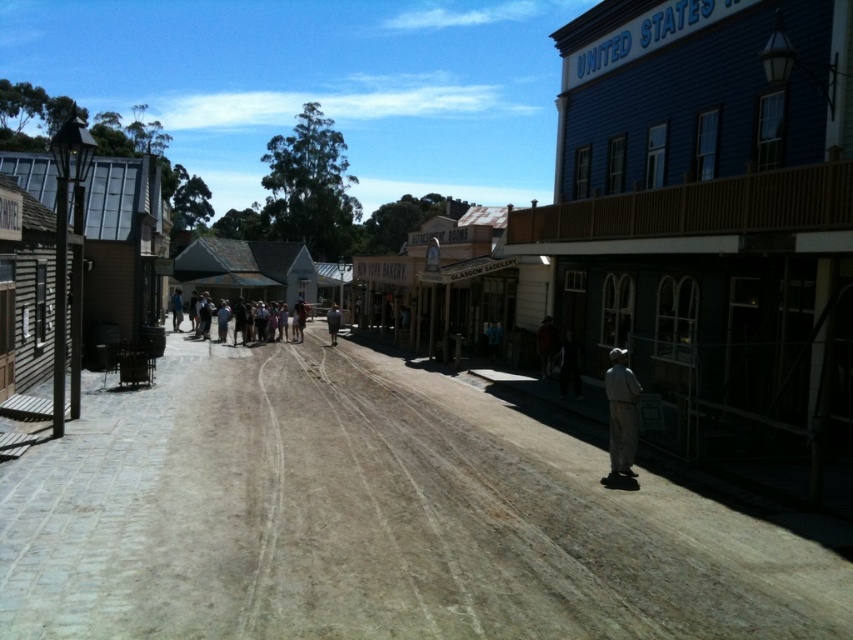
Can you confirm if brown dusty dirt track at center is shorter than brown leather jacket at center?

Yes, brown dusty dirt track at center is shorter than brown leather jacket at center.

Which is below, brown dusty dirt track at center or brown leather jacket at center?

brown dusty dirt track at center is below.

Which is behind, point (231, 499) or point (547, 346)?

Point (547, 346)

Where is `brown dusty dirt track at center`? brown dusty dirt track at center is located at coordinates (373, 518).

Is point (553, 353) in front of point (335, 307)?

Yes.

Between brown leather jacket at center and dark gray fabric jacket at center, which one is positioned higher?

dark gray fabric jacket at center

This screenshot has height=640, width=853. I want to click on brown leather jacket at center, so click(546, 344).

Does brown dusty dirt track at center appear under light blue denim jacket at center?

Indeed, brown dusty dirt track at center is positioned under light blue denim jacket at center.

Does brown dusty dirt track at center appear on the right side of light blue denim jacket at center?

Indeed, brown dusty dirt track at center is positioned on the right side of light blue denim jacket at center.

This screenshot has height=640, width=853. Find the location of `brown dusty dirt track at center`. brown dusty dirt track at center is located at coordinates (373, 518).

Identify the location of brown dusty dirt track at center. (373, 518).